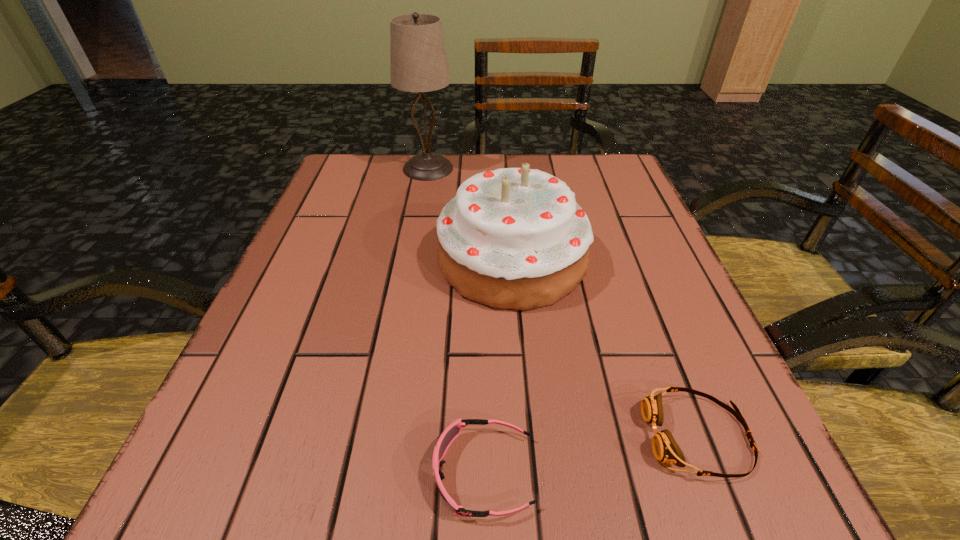
Locate an element on the screen. The image size is (960, 540). vacant space at the right edge of the desktop is located at coordinates (618, 205).

At what (x,y) coordinates should I click in order to perform the action: click on vacant space at the far left corner. Please return your answer as a coordinate pair (x, y). Looking at the image, I should click on (340, 185).

You are a GUI agent. You are given a task and a screenshot of the screen. Output one action in this format:
    pyautogui.click(x=<x>, y=<y>)
    Task: Click on the vacant region at the near left corner of the desktop
    The image size is (960, 540).
    Given the screenshot: What is the action you would take?
    pyautogui.click(x=188, y=468)

In the image, there is a desktop. Identify the location of free space at the near right corner. Image resolution: width=960 pixels, height=540 pixels. (740, 521).

Identify the location of free space that is in between the left goggles and the right goggles. The height and width of the screenshot is (540, 960). (590, 455).

At what (x,y) coordinates should I click in order to perform the action: click on free area in between the left goggles and the third shortest object. Please return your answer as a coordinate pair (x, y). Image resolution: width=960 pixels, height=540 pixels. Looking at the image, I should click on (498, 366).

Image resolution: width=960 pixels, height=540 pixels. I want to click on unoccupied area between the farthest object and the rightmost object, so click(563, 302).

Where is `free point between the farthest object and the left goggles`? free point between the farthest object and the left goggles is located at coordinates [x=456, y=321].

The image size is (960, 540). I want to click on unoccupied area between the rightmost object and the left goggles, so click(590, 455).

Locate an element on the screen. free space between the right goggles and the left goggles is located at coordinates (590, 455).